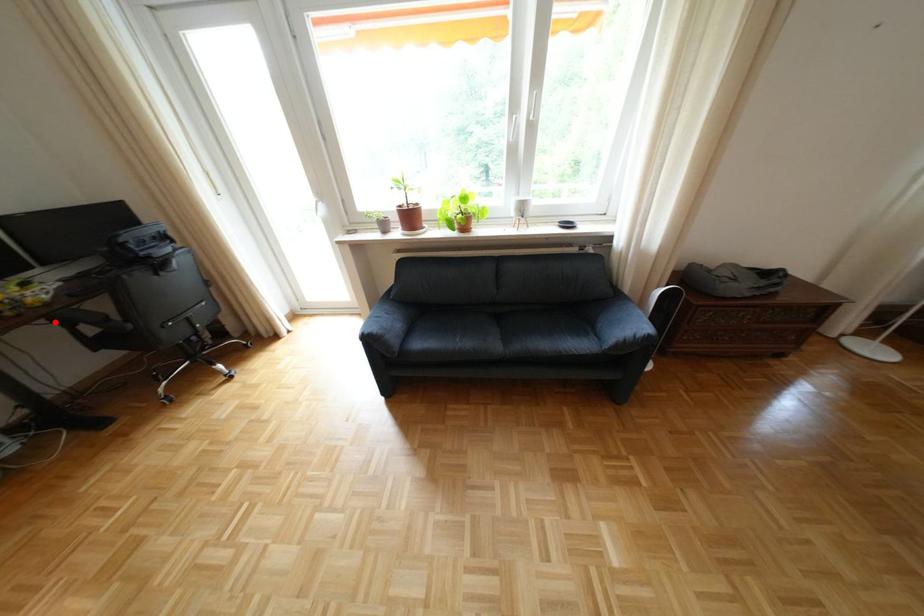
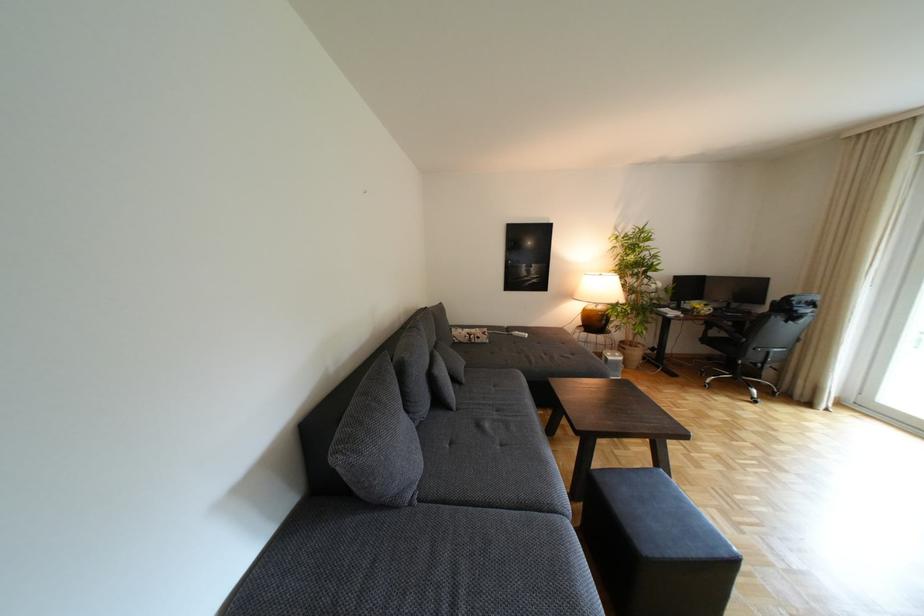
Where in the second image is the point corresponding to the highlighted location from the first image?

(715, 322)